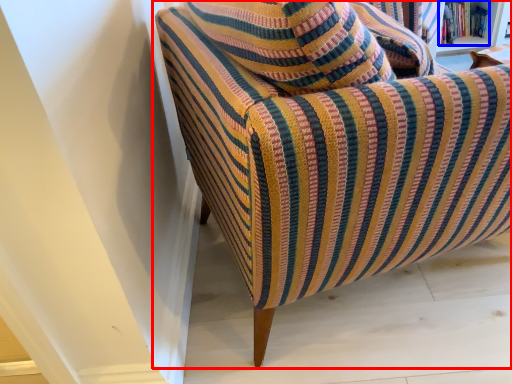
Question: Which object appears closest to the camera in this image, chair (highlighted by a red box) or book (highlighted by a blue box)?

Choices:
 (A) chair
 (B) book

Answer: (A)